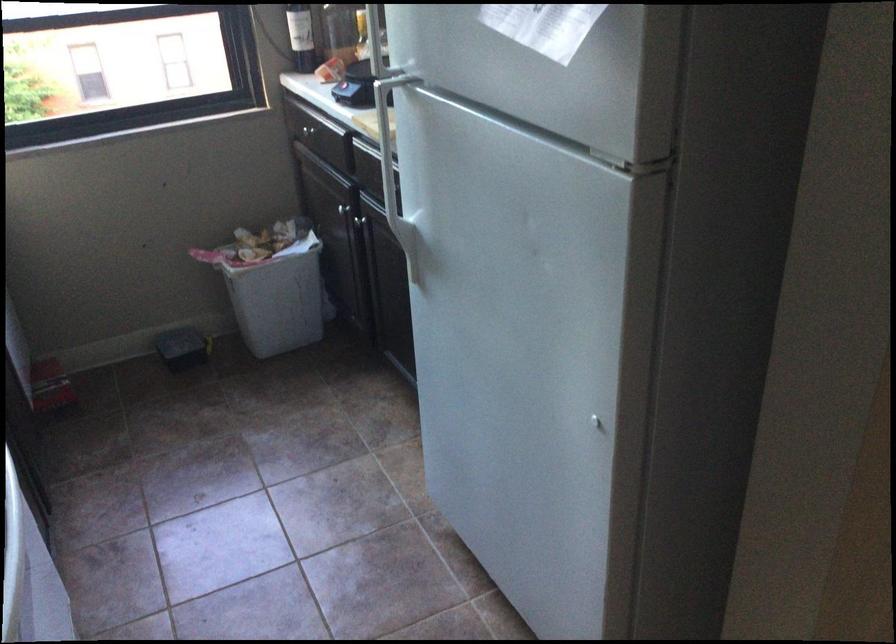
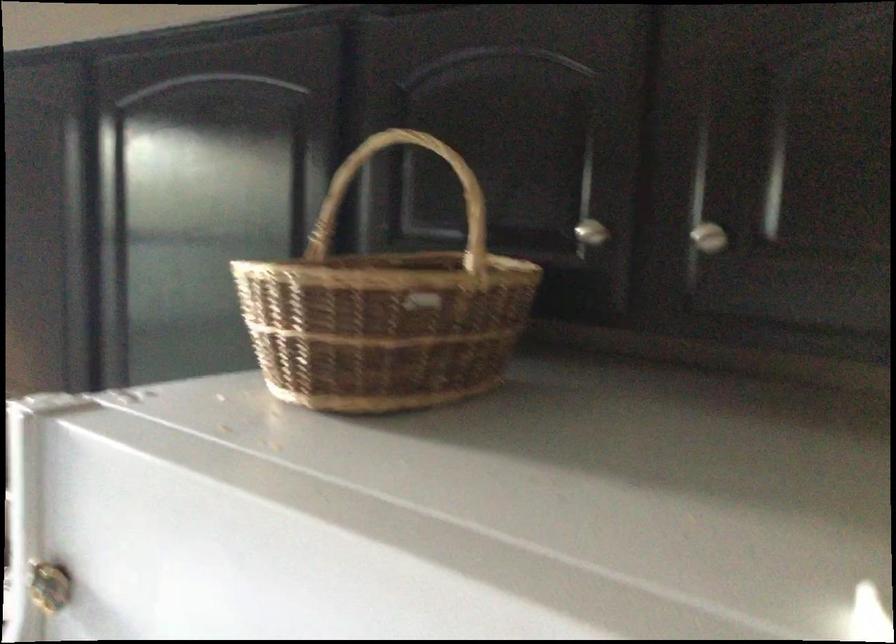
The images are taken continuously from a first-person perspective. In which direction is your viewpoint rotating?

The rotation direction of the camera is right-up.